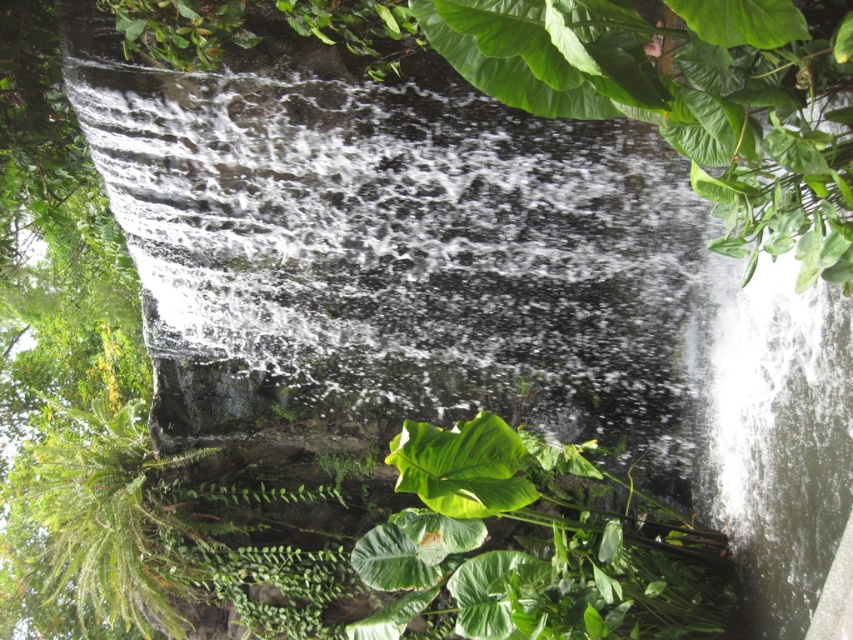
You are a botanist examining the plants in the waterfall scene. You need to determine which plant is narrower between the green leafy plant at center and the green fuzzy fern at lower left. Which one is it?

The green leafy plant at center has a lesser width compared to the green fuzzy fern at lower left, so the green leafy plant at center is narrower.

You are standing at the bottom of the waterfall and want to reach the green leafy plant at center. Which direction should you move to get closer to it?

The green leafy plant at center is located at point 0.855 on the x axis and 0.625 on the y axis. Since you are at the bottom, which is the lower part of the image, moving upwards would increase your y coordinate. To reach the plant, you should move upwards and slightly to the right because its x coordinate is 0.855 and y is 0.625.